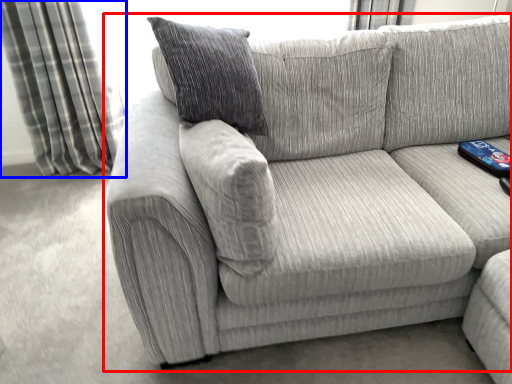
Question: Which of the following is the closest to the observer, studio couch (highlighted by a red box) or curtain (highlighted by a blue box)?

Choices:
 (A) studio couch
 (B) curtain

Answer: (A)